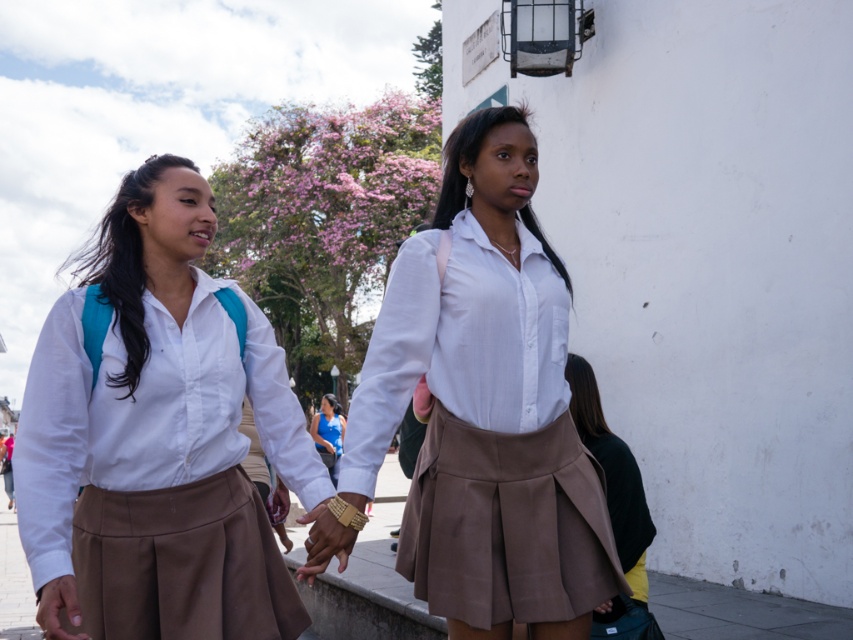
You are a photographer trying to capture a clear shot of the matte white shirt at center and the matte white blouse at center. Since the background has a tree with pink blossoms, which might distract from the subjects, which clothing item should you focus on first to ensure it stays in the frame?

The matte white shirt at center is positioned under the matte white blouse at center, so focusing on the matte white blouse at center first would ensure it stays in frame as it is higher up and less likely to be obscured by the blossoms.

You are a photographer trying to capture both the matte white shirt at center and the matte white blouse at center in a single frame. Which one should you focus on first to ensure the larger object is in clear view?

The matte white shirt at center is larger than the matte white blouse at center, so you should focus on the matte white shirt at center first to ensure it is in clear view.